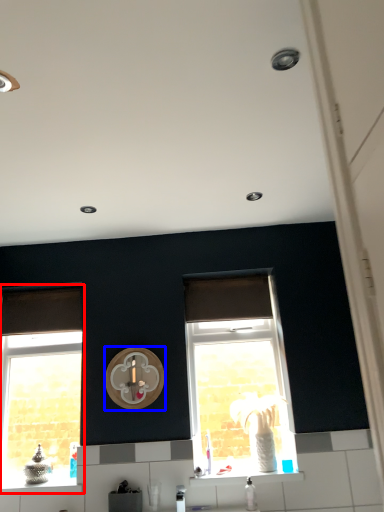
Question: Which object is further to the camera taking this photo, window (highlighted by a red box) or clock (highlighted by a blue box)?

Choices:
 (A) window
 (B) clock

Answer: (A)